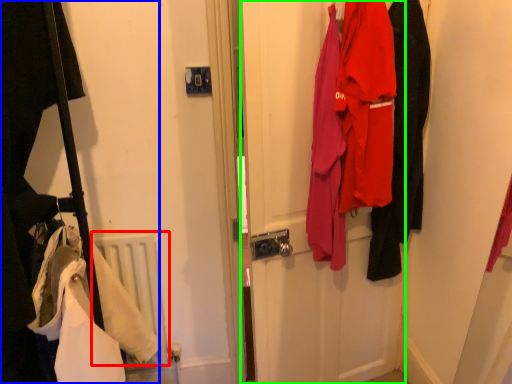
Question: Estimate the real-world distances between objects in this image. Which object is farther from radiator (highlighted by a red box), closet (highlighted by a blue box) or door (highlighted by a green box)?

Choices:
 (A) closet
 (B) door

Answer: (B)